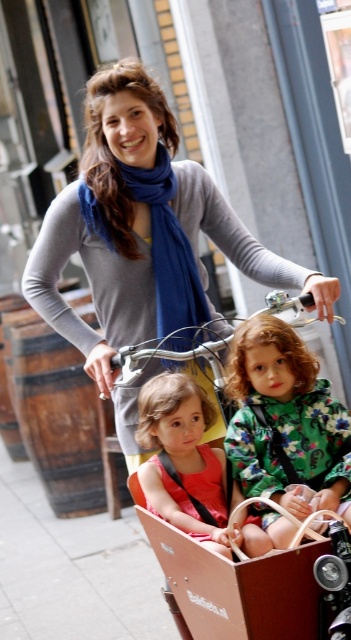
Question: Among these objects, which one is nearest to the camera?

Choices:
 (A) floral-patterned fabric at center
 (B) matte pink dress at center

Answer: (B)

Question: Which point is closer to the camera?

Choices:
 (A) (147, 477)
 (B) (293, 394)

Answer: (A)

Question: Is matte gray sweater at center closer to camera compared to floral-patterned fabric at center?

Choices:
 (A) no
 (B) yes

Answer: (A)

Question: Based on their relative distances, which object is farther from the matte pink dress at center?

Choices:
 (A) floral-patterned fabric at center
 (B) matte gray sweater at center

Answer: (B)

Question: Is matte gray sweater at center to the left of floral-patterned fabric at center from the viewer's perspective?

Choices:
 (A) no
 (B) yes

Answer: (B)

Question: From the image, what is the correct spatial relationship of floral-patterned fabric at center in relation to matte pink dress at center?

Choices:
 (A) right
 (B) left

Answer: (A)